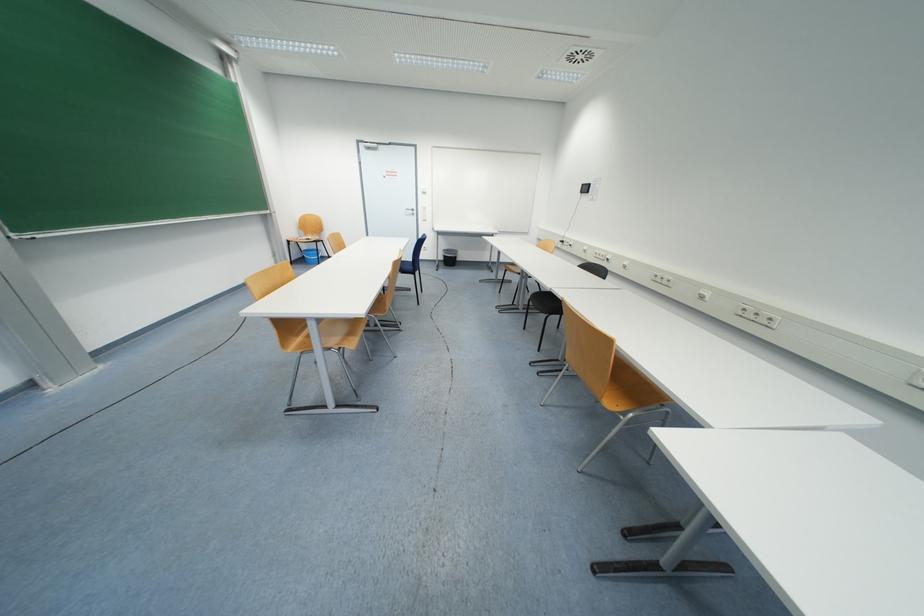
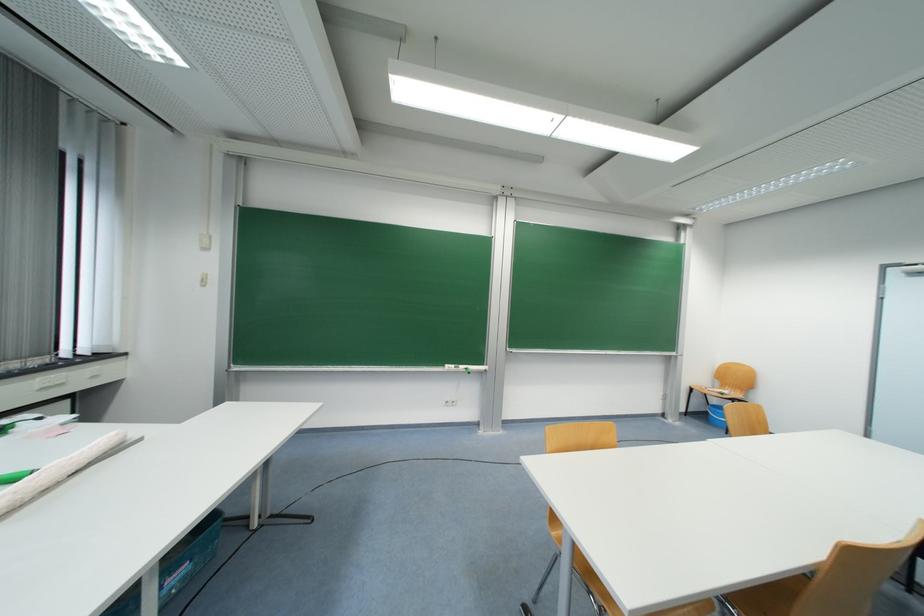
Question: The camera is either moving clockwise (left) or counter-clockwise (right) around the object. The first image is from the beginning of the video and the second image is from the end. Is the camera moving left or right when shooting the video?

Choices:
 (A) Left
 (B) Right

Answer: (B)